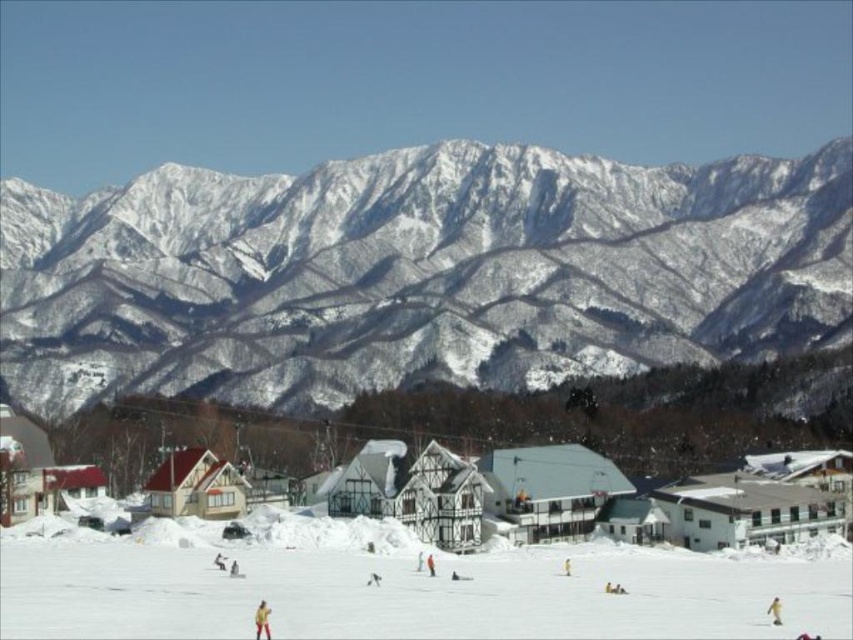
What are the coordinates of the yellow fabric skier at center?

The yellow fabric skier at center is located at coordinates point (775, 611).